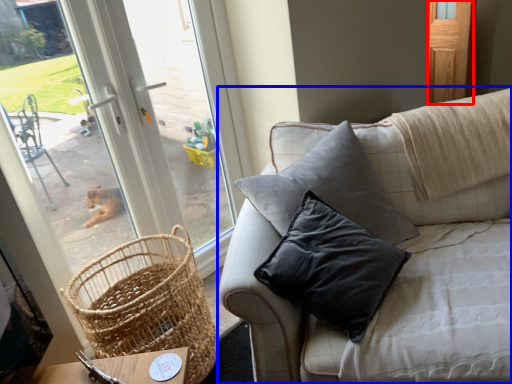
Question: Which object appears closest to the camera in this image, screen door (highlighted by a red box) or studio couch (highlighted by a blue box)?

Choices:
 (A) screen door
 (B) studio couch

Answer: (B)